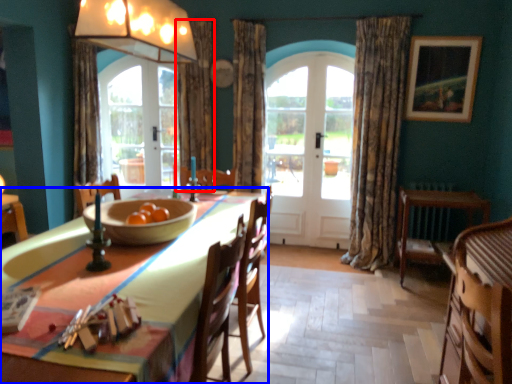
Question: Among these objects, which one is nearest to the camera, curtain (highlighted by a red box) or table (highlighted by a blue box)?

Choices:
 (A) curtain
 (B) table

Answer: (B)